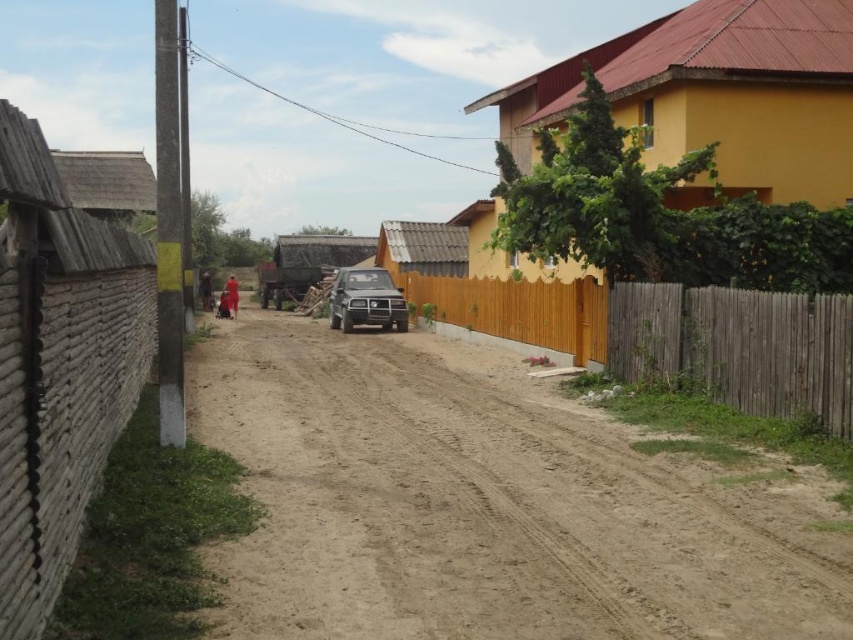
You are driving a satin black suv at center and want to park it on the brown sandy dirt track at center. Is the dirt track to the right or left of the suv?

The brown sandy dirt track at center is to the right of the satin black suv at center, so the dirt track is to the right of the suv.

You are driving a satin black suv at center and want to park it along the dirt road. The brown wooden fence at right is in the way. Can you park the suv without damaging the fence?

The brown wooden fence at right is shorter than the satin black suv at center, so the suv can be parked without damaging the fence since the fence is shorter and less likely to interfere with the vehicle.

You are a delivery driver planning to drive a truck along the brown sandy dirt track at center. The truck requires a path that is wider than the brown wooden fence at right. Can the dirt track accommodate the truck?

The brown sandy dirt track at center is larger in size than the brown wooden fence at right, so yes, the dirt track can accommodate the truck as it is wider than the fence.